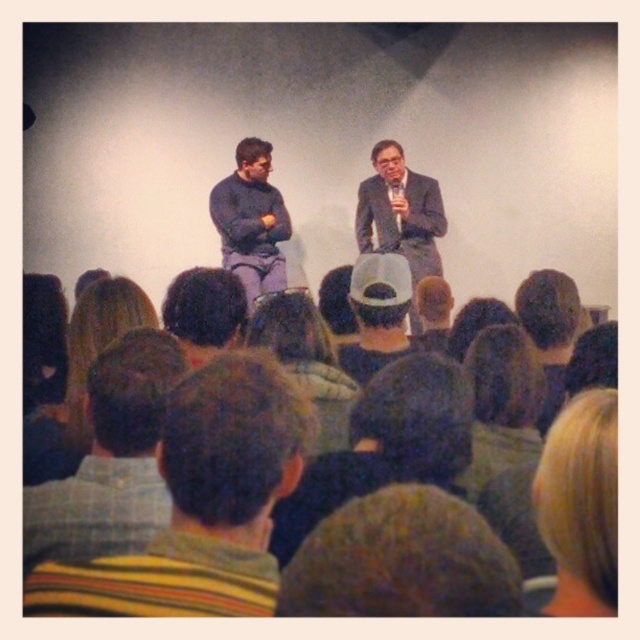
Question: Observing the image, what is the correct spatial positioning of striped sweater at center in reference to matte black suit at center?

Choices:
 (A) right
 (B) left

Answer: (B)

Question: Is striped shirt at lower left positioned before matte blue sweater at center?

Choices:
 (A) no
 (B) yes

Answer: (B)

Question: Which point is closer to the camera?

Choices:
 (A) matte black suit at center
 (B) striped shirt at lower left

Answer: (B)

Question: Which of these objects is positioned closest to the striped sweater at center?

Choices:
 (A) matte black suit at center
 (B) striped shirt at lower left

Answer: (B)

Question: Among these points, which one is farthest from the camera?

Choices:
 (A) (257, 268)
 (B) (396, 176)
 (C) (596, 416)
 (D) (76, 579)

Answer: (B)

Question: Does striped sweater at center appear on the left side of blonde hair at lower right?

Choices:
 (A) yes
 (B) no

Answer: (A)